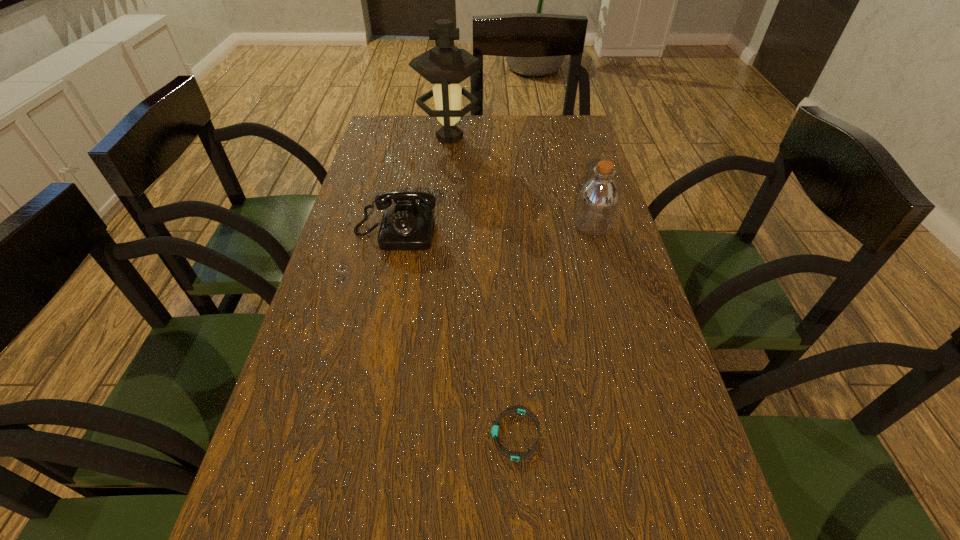
This screenshot has width=960, height=540. I want to click on the farthest object, so click(445, 65).

At what (x,y) coordinates should I click in order to perform the action: click on the tallest object. Please return your answer as a coordinate pair (x, y). Looking at the image, I should click on (445, 65).

Where is `the rightmost object`? The image size is (960, 540). the rightmost object is located at coordinates (597, 202).

Locate an element on the screen. This screenshot has height=540, width=960. the third shortest object is located at coordinates (597, 202).

At what (x,y) coordinates should I click in order to perform the action: click on the second shortest object. Please return your answer as a coordinate pair (x, y). Looking at the image, I should click on (407, 226).

Identify the location of the shortest object. (495, 428).

The height and width of the screenshot is (540, 960). I want to click on the third object from left to right, so pos(495,428).

You are a GUI agent. You are given a task and a screenshot of the screen. Output one action in this format:
    pyautogui.click(x=<x>, y=<y>)
    Task: Click on the free space located on the front of the oil lamp
    The width and height of the screenshot is (960, 540).
    Given the screenshot: What is the action you would take?
    pyautogui.click(x=446, y=173)

At what (x,y) coordinates should I click in order to perform the action: click on vacant space situated on the back of the rightmost object. Please return your answer as a coordinate pair (x, y). Looking at the image, I should click on (573, 156).

Locate an element on the screen. free space located on the dial of the telephone is located at coordinates (365, 381).